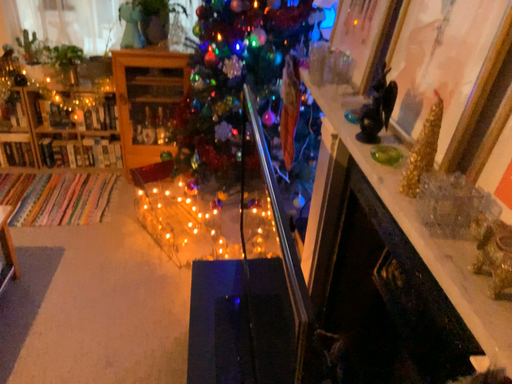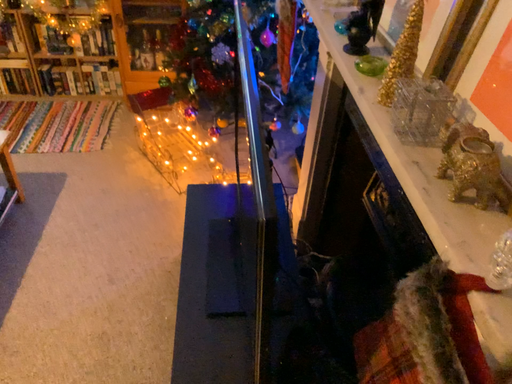
Question: How did the camera likely rotate when shooting the video?

Choices:
 (A) rotated downward
 (B) rotated upward

Answer: (A)